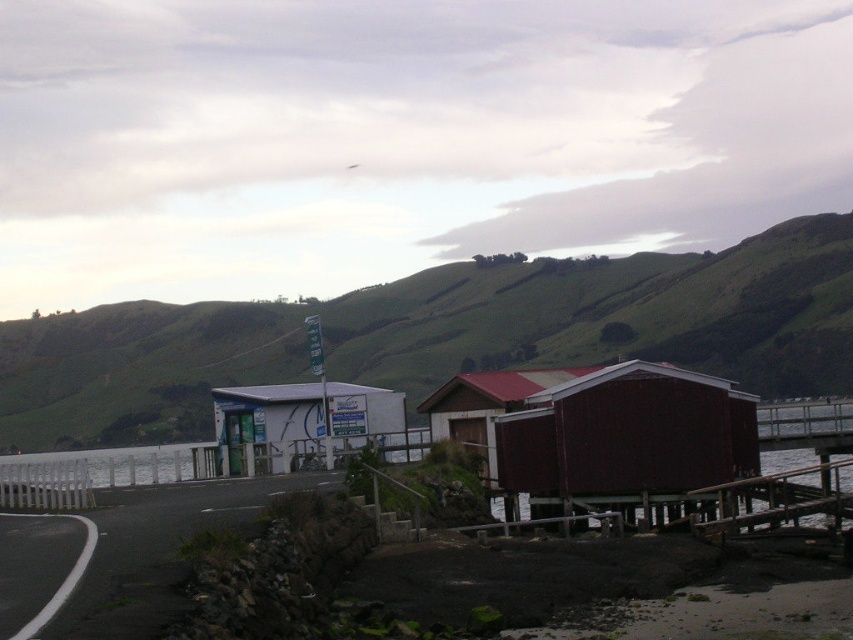
Question: Which point is farther to the camera?

Choices:
 (A) (352, 428)
 (B) (646, 417)

Answer: (A)

Question: Can you confirm if green grassy hillside at upper center is positioned to the right of wooden cabin at center?

Choices:
 (A) yes
 (B) no

Answer: (A)

Question: Where is green grassy hillside at upper center located in relation to dark red wood cabin at center in the image?

Choices:
 (A) left
 (B) right

Answer: (B)

Question: Which is nearer to the green grassy hillside at upper center?

Choices:
 (A) dark red wood cabin at center
 (B) wooden cabin at center
 (C) white plastic building at center

Answer: (C)

Question: Among these objects, which one is farthest from the camera?

Choices:
 (A) wooden cabin at center
 (B) green grassy hillside at upper center

Answer: (B)

Question: Does dark red wood cabin at center appear over white plastic building at center?

Choices:
 (A) no
 (B) yes

Answer: (A)